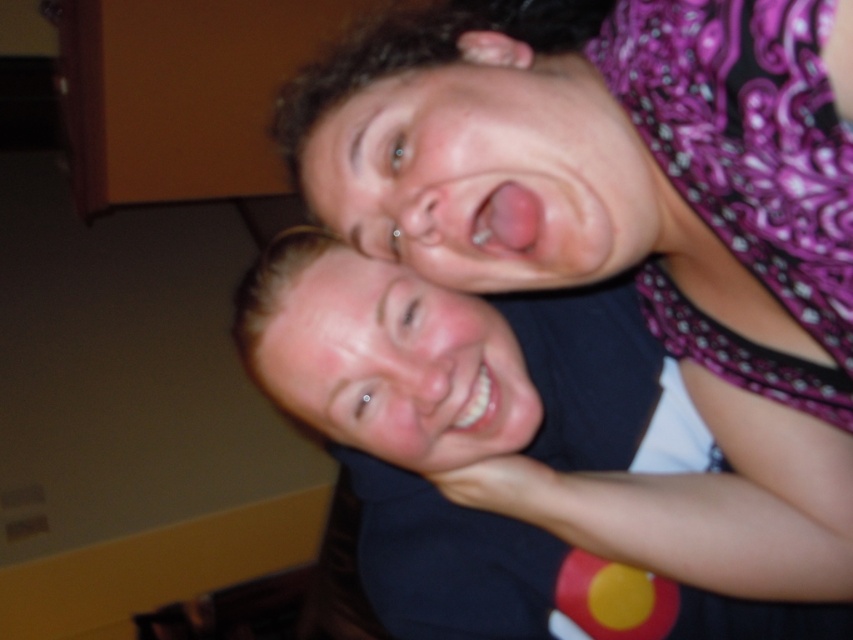
Question: Is matte black shirt at upper center thinner than smooth skin face at center?

Choices:
 (A) yes
 (B) no

Answer: (B)

Question: Which object appears closest to the camera in this image?

Choices:
 (A) matte black shirt at upper center
 (B) smooth skin face at center

Answer: (A)

Question: Among these points, which one is farthest from the camera?

Choices:
 (A) (346, 390)
 (B) (431, 176)
 (C) (654, 576)

Answer: (C)

Question: Estimate the real-world distances between objects in this image. Which object is farther from the matte black shirt at upper center?

Choices:
 (A) matte skin face at upper center
 (B) smooth skin face at center

Answer: (A)

Question: Is matte black shirt at upper center positioned before smooth skin face at center?

Choices:
 (A) no
 (B) yes

Answer: (B)

Question: Does matte black shirt at upper center come behind smooth skin face at center?

Choices:
 (A) no
 (B) yes

Answer: (A)